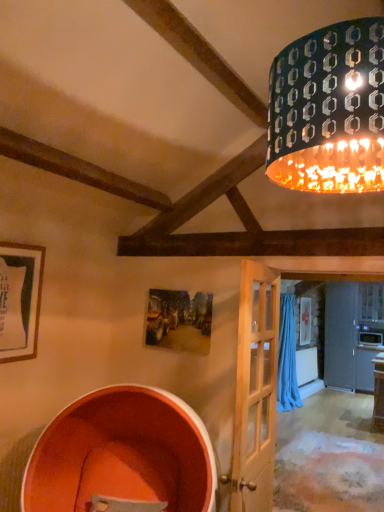
Measure the distance between point (x=162, y=508) and camera.

The distance of point (x=162, y=508) from camera is 2.57 meters.

Describe the element at coordinates (122, 455) in the screenshot. I see `orange matte barrel at lower left` at that location.

This screenshot has height=512, width=384. What do you see at coordinates (255, 390) in the screenshot?
I see `light wood door at center` at bounding box center [255, 390].

Find the location of a particular element. This screenshot has height=512, width=384. light wood door at center is located at coordinates (255, 390).

Find the location of a particular element. orange matte barrel at lower left is located at coordinates (122, 455).

From a real-world perspective, between matte black picture frame at left and blue fabric curtain at right, who is vertically lower?

blue fabric curtain at right is physically lower.

Is matte black picture frame at left behind blue fabric curtain at right?

That is False.

Is blue fabric curtain at right completely or partially inside matte black picture frame at left?

That's incorrect, blue fabric curtain at right is not inside matte black picture frame at left.

Considering the relative sizes of matte black picture frame at left and blue fabric curtain at right in the image provided, is matte black picture frame at left shorter than blue fabric curtain at right?

Yes.

You are a GUI agent. You are given a task and a screenshot of the screen. Output one action in this format:
    pyautogui.click(x=<x>, y=<y>)
    Task: Click on the picture frame positioned vertically above the blue fabric curtain at right (from a real-world perspective)
    This screenshot has height=512, width=384.
    Given the screenshot: What is the action you would take?
    pyautogui.click(x=20, y=300)

Considering the sizes of objects blue fabric curtain at right and matte black picture frame at left in the image provided, who is shorter, blue fabric curtain at right or matte black picture frame at left?

matte black picture frame at left is shorter.

Is the position of blue fabric curtain at right more distant than that of matte black picture frame at left?

Yes, blue fabric curtain at right is further from the viewer.

Does point (81, 419) lie in front of point (357, 181)?

No, it is not.

Looking at this image, from the image's perspective, who appears lower, orange matte barrel at lower left or metallic patterned shade at upper right?

orange matte barrel at lower left.

Where is `barrel on the left of metallic patterned shade at upper right`? This screenshot has width=384, height=512. barrel on the left of metallic patterned shade at upper right is located at coordinates (122, 455).

Is orange matte barrel at lower left outside of metallic patterned shade at upper right?

orange matte barrel at lower left lies outside metallic patterned shade at upper right's area.

From a real-world perspective, which object stands above the other?

In real-world perspective, blue fabric curtain at right is above.

Can you tell me how much blue fabric curtain at right and orange matte barrel at lower left differ in facing direction?

The angle between the facing direction of blue fabric curtain at right and the facing direction of orange matte barrel at lower left is 64.6 degrees.

From the image's perspective, is blue fabric curtain at right on orange matte barrel at lower left?

Actually, blue fabric curtain at right appears below orange matte barrel at lower left in the image.

Considering the sizes of objects light wood door at center and blue fabric curtain at right in the image provided, who is wider, light wood door at center or blue fabric curtain at right?

blue fabric curtain at right.

Is light wood door at center in contact with blue fabric curtain at right?

No, light wood door at center is not in contact with blue fabric curtain at right.

How different are the orientations of light wood door at center and blue fabric curtain at right in degrees?

The facing directions of light wood door at center and blue fabric curtain at right are 0.803 degrees apart.

In the image, there is a light wood door at center. In order to click on curtain below it (from the image's perspective) in this screenshot , I will do `click(287, 357)`.

Which object is positioned more to the right, metallic patterned shade at upper right or orange matte barrel at lower left?

metallic patterned shade at upper right.

How different are the orientations of metallic patterned shade at upper right and orange matte barrel at lower left in degrees?

They differ by 62.5 degrees in their facing directions.

From a real-world perspective, is metallic patterned shade at upper right physically located above or below orange matte barrel at lower left?

metallic patterned shade at upper right is above orange matte barrel at lower left.

Which object is more forward, metallic patterned shade at upper right or orange matte barrel at lower left?

Positioned in front is metallic patterned shade at upper right.

Can you confirm if metallic patterned shade at upper right is taller than light wood door at center?

Incorrect, the height of metallic patterned shade at upper right is not larger of that of light wood door at center.

Can you confirm if metallic patterned shade at upper right is bigger than light wood door at center?

Correct, metallic patterned shade at upper right is larger in size than light wood door at center.

From the picture: Visually, is metallic patterned shade at upper right positioned to the left or to the right of light wood door at center?

From the image, it's evident that metallic patterned shade at upper right is to the right of light wood door at center.

Is the position of metallic patterned shade at upper right more distant than that of light wood door at center?

No, it is in front of light wood door at center.

Locate an element on the screen. curtain that is under the matte black picture frame at left (from a real-world perspective) is located at coordinates (287, 357).

The image size is (384, 512). In the image, there is a blue fabric curtain at right. Identify the location of picture frame above it (from the image's perspective). (20, 300).

From the image, which object appears to be nearer to matte black picture frame at left, orange matte barrel at lower left or metallic patterned shade at upper right?

orange matte barrel at lower left lies closer to matte black picture frame at left than the other object.

From the image, which object appears to be farther from orange matte barrel at lower left, matte black picture frame at left or blue fabric curtain at right?

Among the two, blue fabric curtain at right is located further to orange matte barrel at lower left.

Consider the image. Considering their positions, is matte black picture frame at left positioned further to light wood door at center than metallic patterned shade at upper right?

matte black picture frame at left is further to light wood door at center.

From the image, which object appears to be nearer to metallic patterned shade at upper right, blue fabric curtain at right or light wood door at center?

Based on the image, light wood door at center appears to be nearer to metallic patterned shade at upper right.

Consider the image. Looking at the image, which one is located further to orange matte barrel at lower left, light wood door at center or matte black picture frame at left?

matte black picture frame at left is further to orange matte barrel at lower left.

Considering their positions, is metallic patterned shade at upper right positioned closer to matte black picture frame at left than blue fabric curtain at right?

The object closer to matte black picture frame at left is metallic patterned shade at upper right.

Estimate the real-world distances between objects in this image. Which object is further from orange matte barrel at lower left, light wood door at center or blue fabric curtain at right?

blue fabric curtain at right lies further to orange matte barrel at lower left than the other object.

Estimate the real-world distances between objects in this image. Which object is closer to metallic patterned shade at upper right, light wood door at center or blue fabric curtain at right?

light wood door at center is closer to metallic patterned shade at upper right.

Locate an element on the screen. barrel between metallic patterned shade at upper right and blue fabric curtain at right from front to back is located at coordinates (122, 455).

You are a GUI agent. You are given a task and a screenshot of the screen. Output one action in this format:
    pyautogui.click(x=<x>, y=<y>)
    Task: Click on the picture frame between metallic patterned shade at upper right and orange matte barrel at lower left from top to bottom
    
    Given the screenshot: What is the action you would take?
    pyautogui.click(x=20, y=300)

Find the location of a particular element. This screenshot has height=512, width=384. door situated between matte black picture frame at left and metallic patterned shade at upper right from left to right is located at coordinates (255, 390).

Find the location of `picture frame between light wood door at center and blue fabric curtain at right in the front-back direction`. picture frame between light wood door at center and blue fabric curtain at right in the front-back direction is located at coordinates pyautogui.click(x=20, y=300).